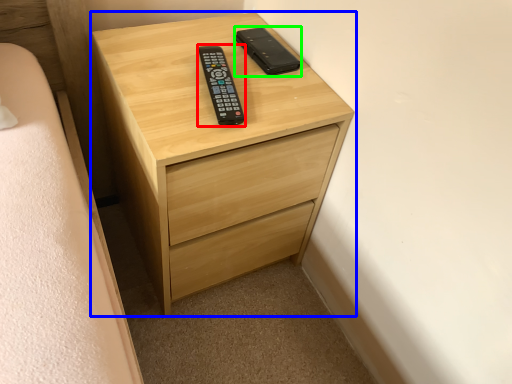
Question: Estimate the real-world distances between objects in this image. Which object is farther from control (highlighted by a red box), chest of drawers (highlighted by a blue box) or control (highlighted by a green box)?

Choices:
 (A) chest of drawers
 (B) control

Answer: (A)